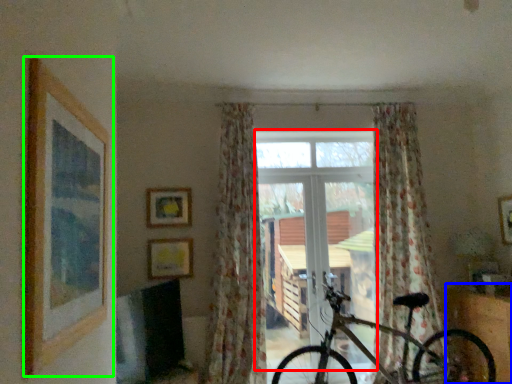
Question: Which is farther away from window frame (highlighted by a red box)? furniture (highlighted by a blue box) or picture frame (highlighted by a green box)?

Choices:
 (A) furniture
 (B) picture frame

Answer: (B)